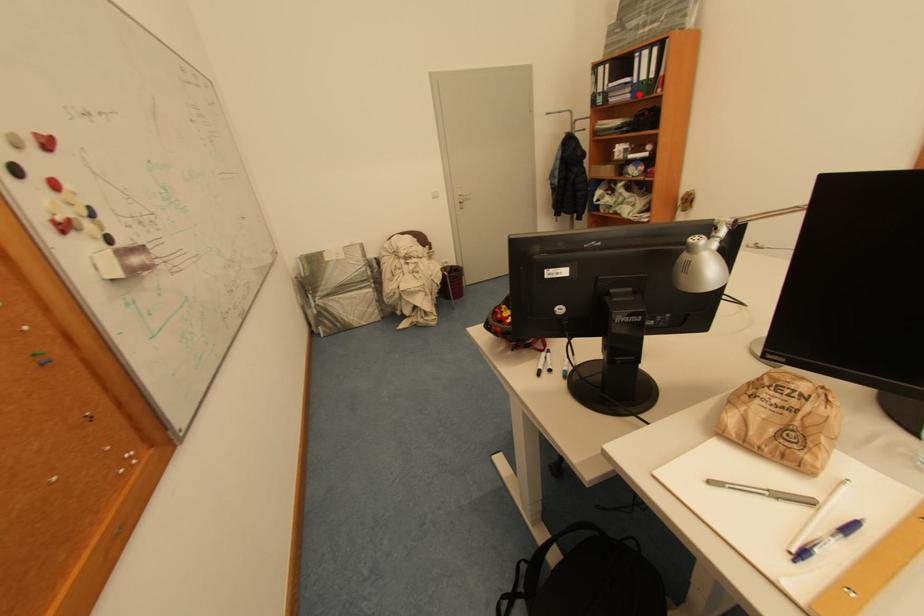
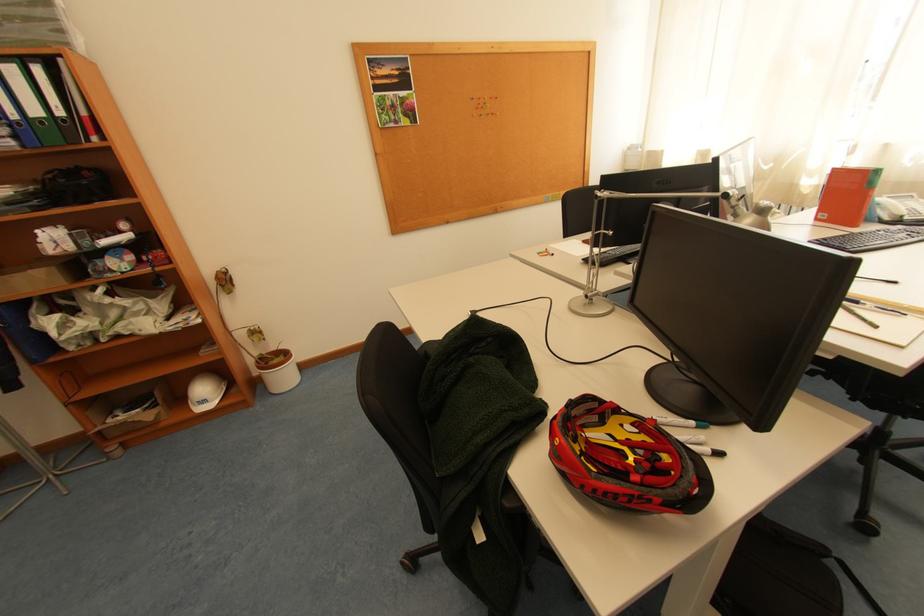
Question: I am providing you with two images of the same scene from different viewpoints. In image1, a red point is highlighted. Considering the same 3D point in image2, which of the following is correct?

Choices:
 (A) It is closer
 (B) It is farther

Answer: (B)